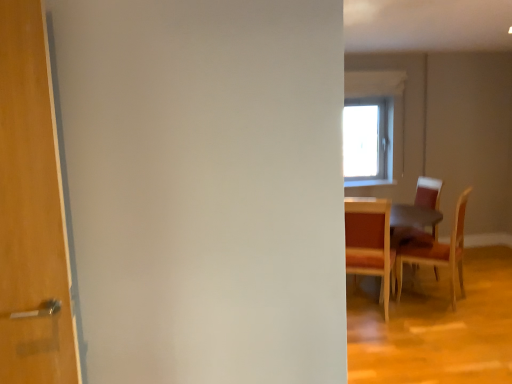
At what (x,y) coordinates should I click in order to perform the action: click on vacant space in front of wooden chair at right, which is counted as the 3th chair, starting from the right. Please return your answer as a coordinate pair (x, y). The height and width of the screenshot is (384, 512). Looking at the image, I should click on (377, 329).